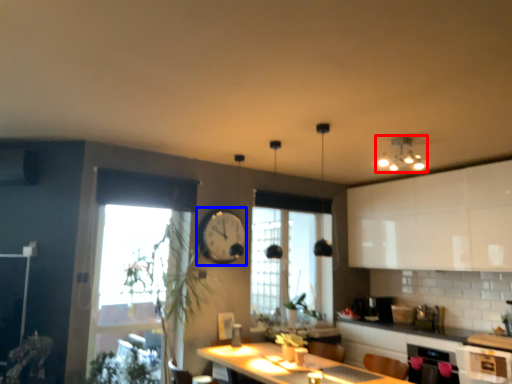
Question: Which point is closer to the camera, light fixture (highlighted by a red box) or clock (highlighted by a blue box)?

Choices:
 (A) light fixture
 (B) clock

Answer: (A)